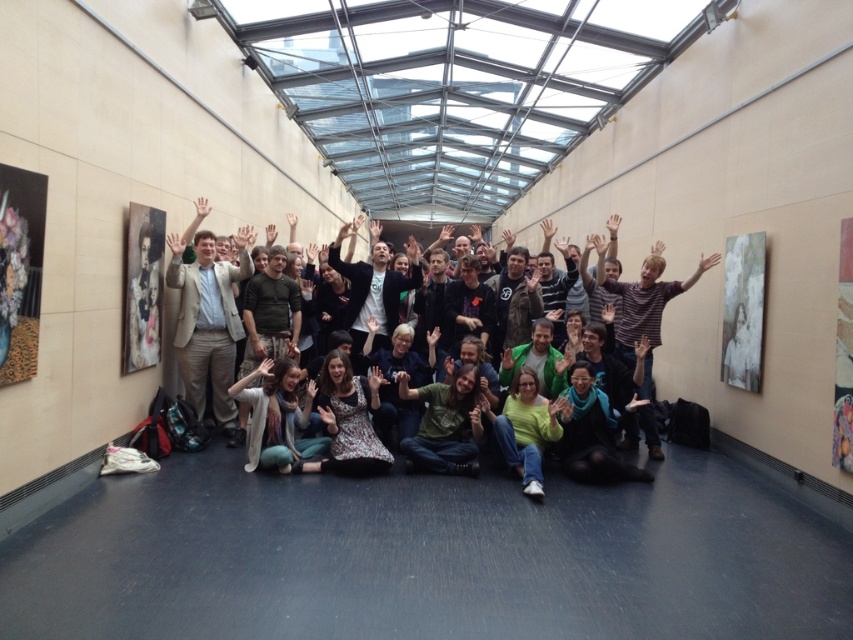
Question: Among these points, which one is nearest to the camera?

Choices:
 (A) (183, 285)
 (B) (645, 356)

Answer: (A)

Question: Which point is farther to the camera?

Choices:
 (A) (201, 416)
 (B) (630, 300)

Answer: (A)

Question: Where is matte black jacket at center located in relation to green jersey at center in the image?

Choices:
 (A) below
 (B) above

Answer: (B)

Question: Does matte black jacket at center have a larger size compared to green jersey at center?

Choices:
 (A) no
 (B) yes

Answer: (B)

Question: Which of the following is the closest to the observer?

Choices:
 (A) matte black jacket at center
 (B) green jersey at center

Answer: (A)

Question: Can you confirm if matte black jacket at center is positioned to the right of green jersey at center?

Choices:
 (A) no
 (B) yes

Answer: (A)